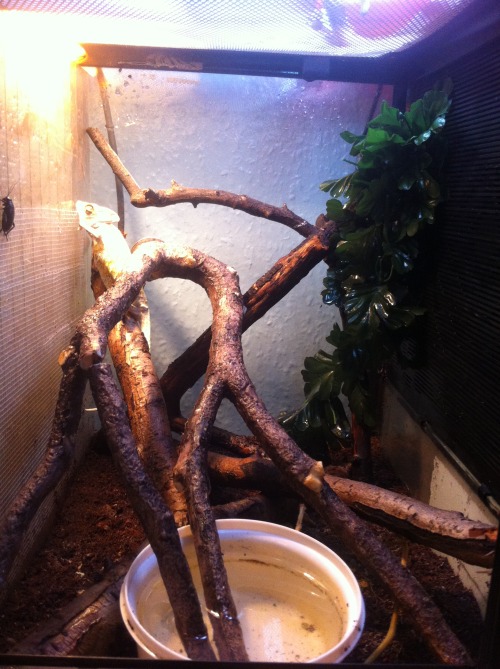
Find the location of a particular element. wall is located at coordinates (266, 140).